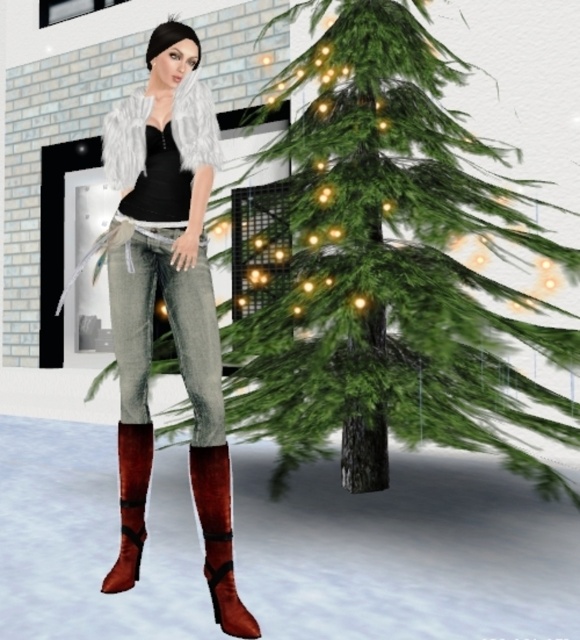
Between suede/leather boot at lower center and velvet red boot at lower left, which one has more height?

velvet red boot at lower left

Which is more to the right, suede/leather boot at lower center or velvet red boot at lower left?

suede/leather boot at lower center is more to the right.

This screenshot has width=580, height=640. I want to click on suede/leather boot at lower center, so click(x=219, y=536).

Does green matte christmas tree at center appear under suede boots at lower center?

Incorrect, green matte christmas tree at center is not positioned below suede boots at lower center.

Who is positioned more to the right, green matte christmas tree at center or suede boots at lower center?

Positioned to the right is green matte christmas tree at center.

The width and height of the screenshot is (580, 640). What do you see at coordinates (392, 268) in the screenshot?
I see `green matte christmas tree at center` at bounding box center [392, 268].

Find the location of a particular element. green matte christmas tree at center is located at coordinates pos(392,268).

Can you confirm if green matte christmas tree at center is smaller than velvet red boot at lower left?

No, green matte christmas tree at center is not smaller than velvet red boot at lower left.

Can you confirm if green matte christmas tree at center is taller than velvet red boot at lower left?

Yes.

Which is in front, point (304, 394) or point (113, 589)?

Point (113, 589) is in front.

Where is `green matte christmas tree at center`? The image size is (580, 640). green matte christmas tree at center is located at coordinates (392, 268).